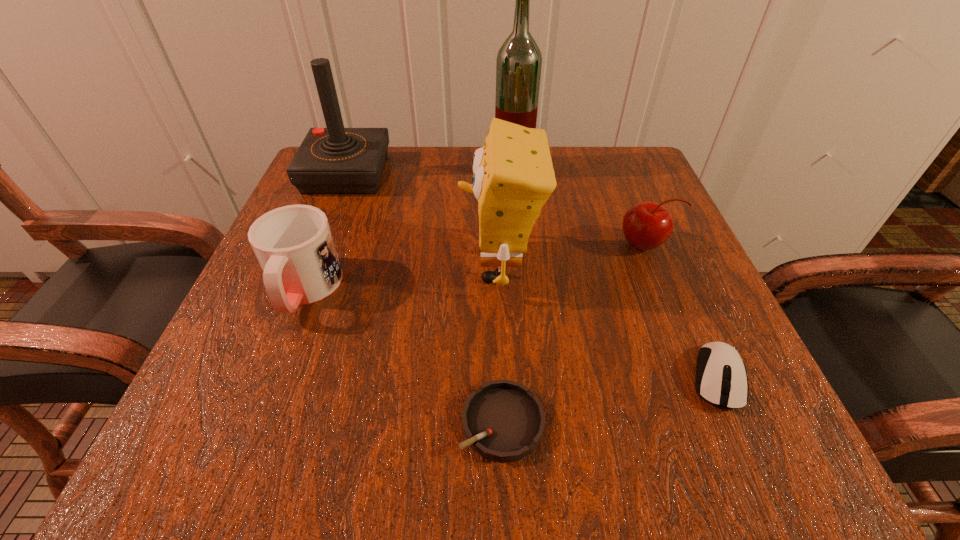
The width and height of the screenshot is (960, 540). I want to click on free space located 0.080m on the face of the sponge, so pyautogui.click(x=416, y=266).

The width and height of the screenshot is (960, 540). I want to click on vacant space located 0.270m on the face of the sponge, so 308,266.

The width and height of the screenshot is (960, 540). What are the coordinates of `vacant region located 0.060m on the side of the mug with the handle` in the screenshot? It's located at (276, 361).

At what (x,y) coordinates should I click in order to perform the action: click on vacant region located on the left of the cherry. Please return your answer as a coordinate pair (x, y). The image size is (960, 540). Looking at the image, I should click on (575, 245).

What are the coordinates of `vacant region located 0.140m on the back of the mouse` in the screenshot? It's located at (674, 279).

You are a GUI agent. You are given a task and a screenshot of the screen. Output one action in this format:
    pyautogui.click(x=<x>, y=<y>)
    Task: Click on the vacant space located on the right of the ashtray
    The height and width of the screenshot is (540, 960).
    Given the screenshot: What is the action you would take?
    (583, 422)

Find the location of a particular element. This screenshot has height=540, width=960. liquor located in the far edge section of the desktop is located at coordinates (518, 66).

I want to click on joystick located in the far edge section of the desktop, so click(335, 160).

This screenshot has height=540, width=960. Find the location of `mouse that is at the near edge`. mouse that is at the near edge is located at coordinates (721, 379).

The height and width of the screenshot is (540, 960). What are the coordinates of `ashtray that is at the near edge` in the screenshot? It's located at (503, 421).